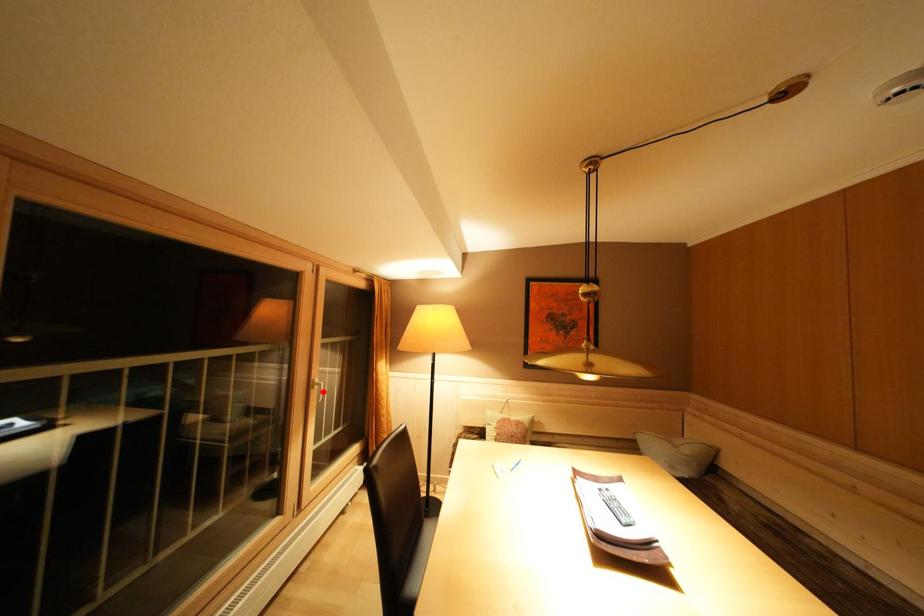
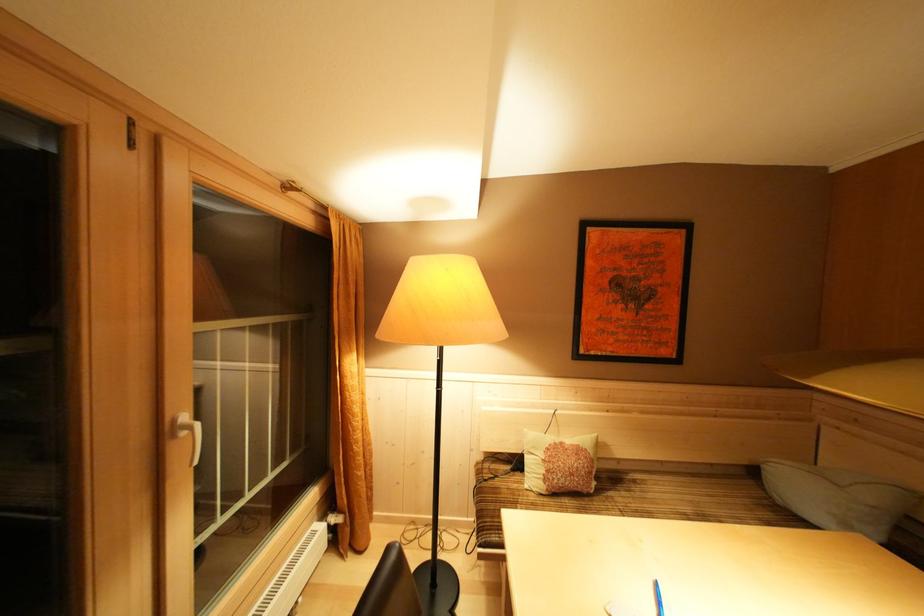
In the second image, find the point that corresponds to the highlighted location in the first image.

(190, 438)